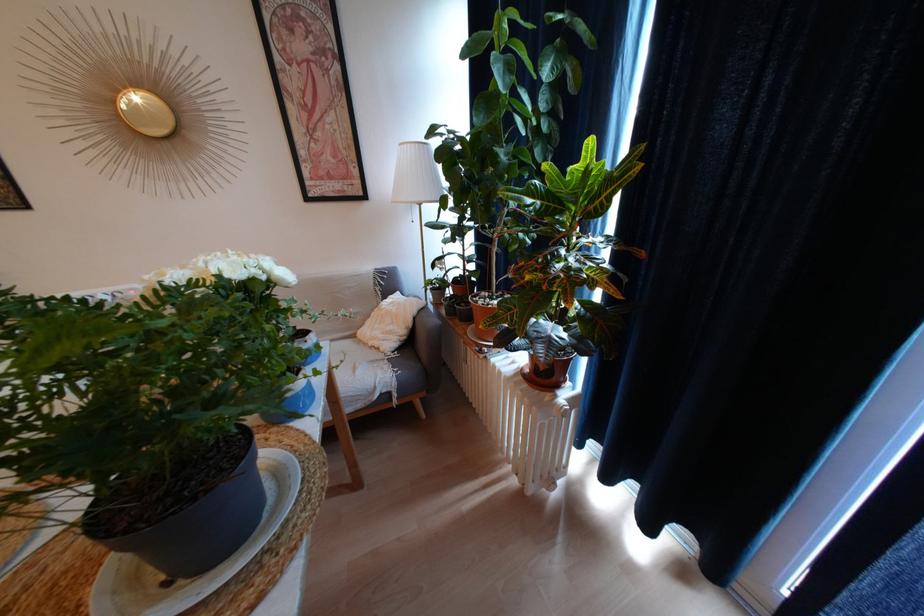
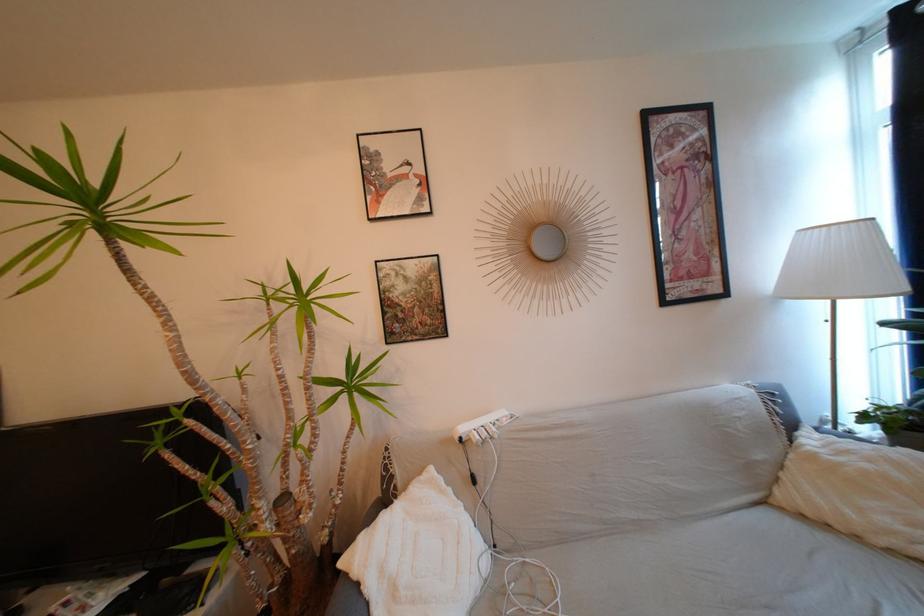
Question: The images are taken continuously from a first-person perspective. In which direction are you moving?

Choices:
 (A) Left
 (B) Right
 (C) Forward
 (D) Backward

Answer: (A)